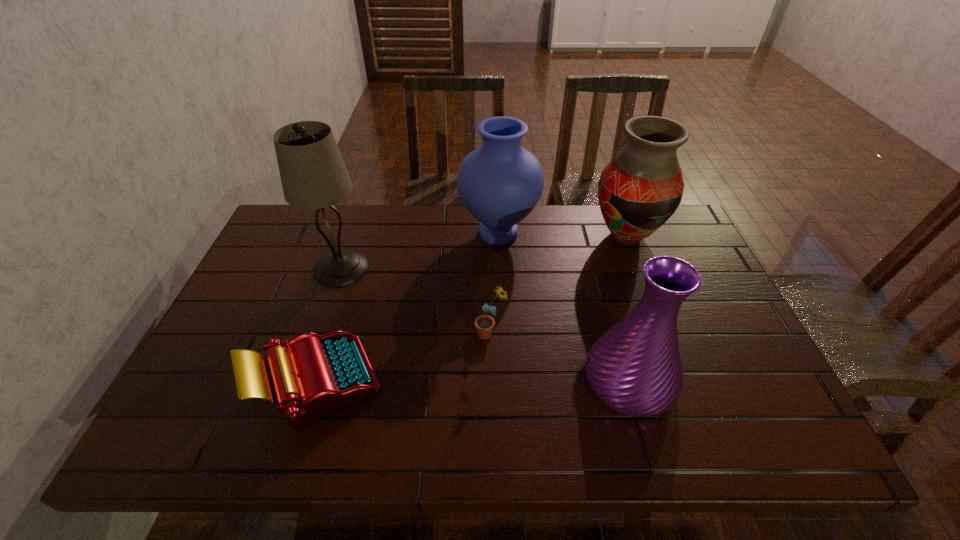
Identify the location of the tallest object. The width and height of the screenshot is (960, 540). (313, 174).

At what (x,y) coordinates should I click in order to perform the action: click on the leftmost vase. Please return your answer as a coordinate pair (x, y). The width and height of the screenshot is (960, 540). Looking at the image, I should click on (500, 183).

Find the location of a particular element. This screenshot has width=960, height=540. the nearest vase is located at coordinates (635, 368).

Locate an element on the screen. the fifth tallest object is located at coordinates (484, 324).

Locate an element on the screen. This screenshot has height=540, width=960. typewriter is located at coordinates (315, 375).

You are a GUI agent. You are given a task and a screenshot of the screen. Output one action in this format:
    pyautogui.click(x=<x>, y=<y>)
    Task: Click on the vacant space located on the front-facing side of the tallest object
    The image size is (960, 540).
    Given the screenshot: What is the action you would take?
    pyautogui.click(x=319, y=336)

The image size is (960, 540). Find the location of `vacant space located 0.160m on the front of the leftmost vase`. vacant space located 0.160m on the front of the leftmost vase is located at coordinates 502,298.

The height and width of the screenshot is (540, 960). Find the location of `free region located on the left of the nearest vase`. free region located on the left of the nearest vase is located at coordinates click(x=527, y=382).

I want to click on blank area located on the flower of the sunflower, so click(403, 334).

Find the location of `free space located 0.280m on the flower of the sunflower`. free space located 0.280m on the flower of the sunflower is located at coordinates (363, 334).